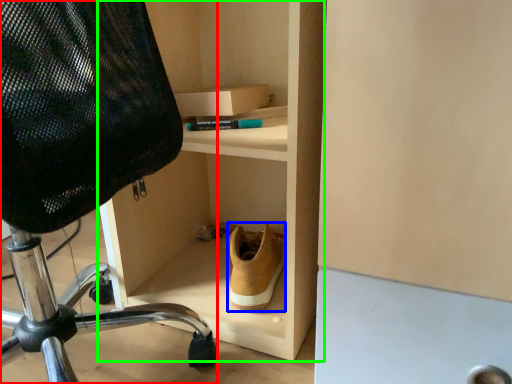
Question: Based on their relative distances, which object is farther from chair (highlighted by a red box)? Choose from shoe (highlighted by a blue box) and shelf (highlighted by a green box).

Choices:
 (A) shoe
 (B) shelf

Answer: (B)